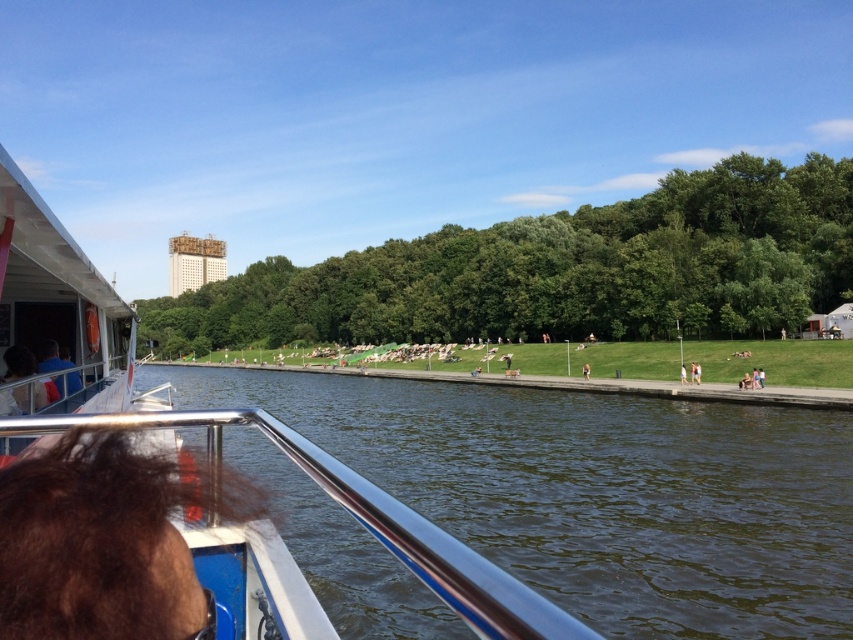
Question: Is matte black hair at lower left to the right of blue fabric shirt at left from the viewer's perspective?

Choices:
 (A) yes
 (B) no

Answer: (A)

Question: Can you confirm if dark green water at center is positioned above blue fabric shirt at left?

Choices:
 (A) yes
 (B) no

Answer: (B)

Question: Which of the following is the closest to the observer?

Choices:
 (A) (70, 362)
 (B) (587, 371)
 (C) (20, 394)
 (D) (834, 621)

Answer: (C)

Question: Observing the image, what is the correct spatial positioning of dark green water at center in reference to blue fabric shirt at left?

Choices:
 (A) right
 (B) left

Answer: (A)

Question: Estimate the real-world distances between objects in this image. Which object is closer to the dark green water at center?

Choices:
 (A) blue fabric shirt at left
 (B) brown fabric person at center
 (C) matte black hair at lower left

Answer: (B)

Question: Which of the following is the farthest from the observer?

Choices:
 (A) (61, 380)
 (B) (770, 588)
 (C) (44, 390)

Answer: (A)